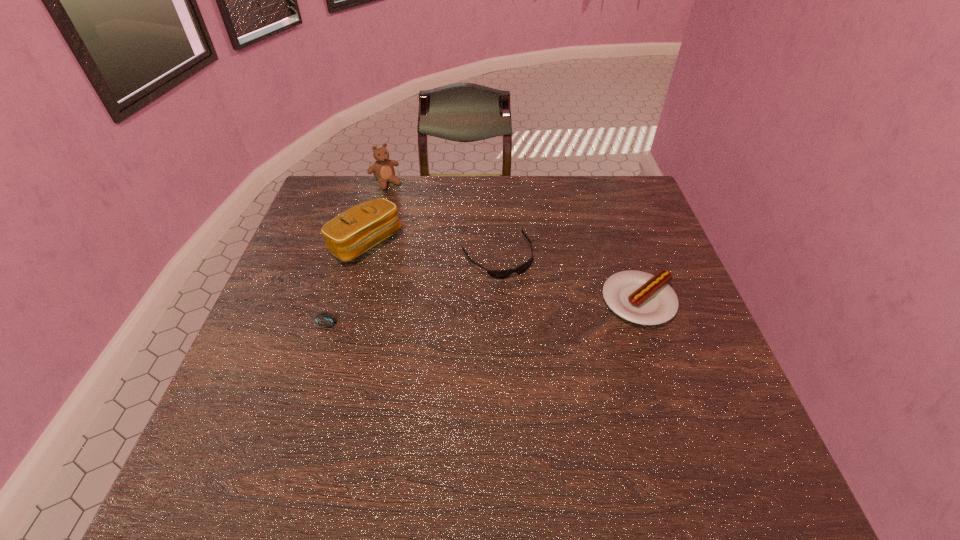
Locate an element on the screen. vacant point that satisfies the following two spatial constraints: 1. on the back side of the shortest object; 2. on the right side of the clutch bag is located at coordinates (361, 244).

Identify the location of vacant space that satisfies the following two spatial constraints: 1. on the back side of the mouse; 2. on the right side of the rightmost object. The width and height of the screenshot is (960, 540). (345, 301).